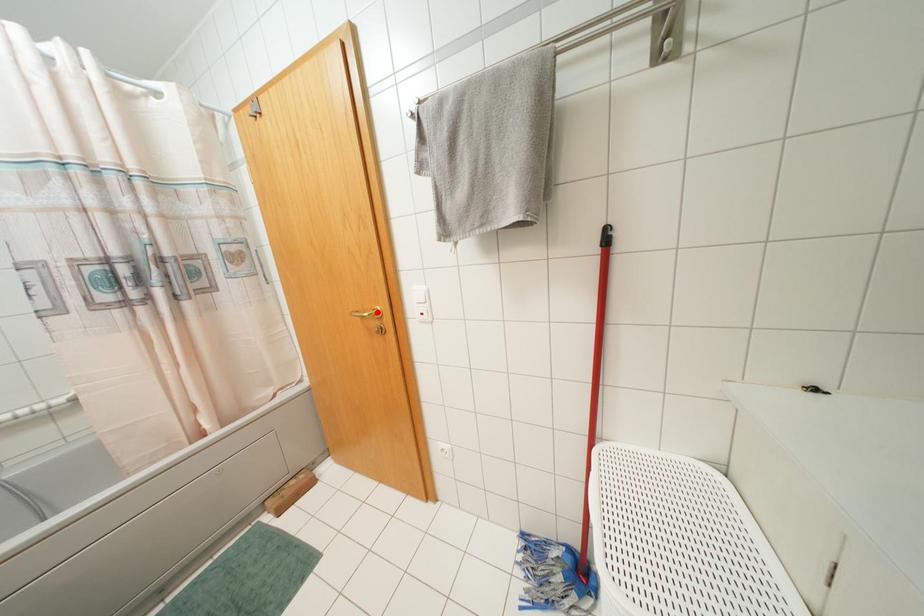
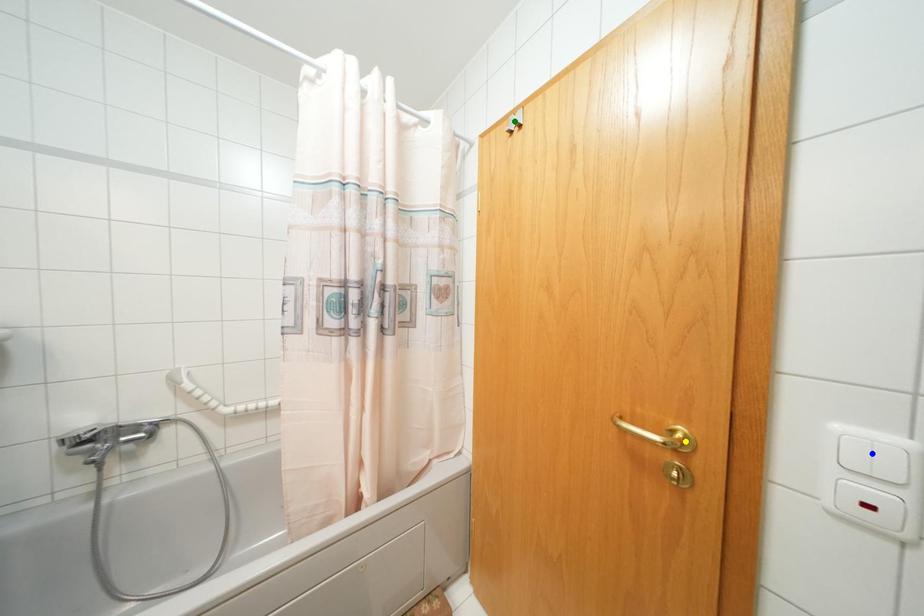
Question: I am providing you with two images of the same scene from different viewpoints. A red point is marked on the first image. You are given multiple points on the second image. Which mark in image 2 goes with the point in image 1?

Choices:
 (A) green point
 (B) yellow point
 (C) blue point

Answer: (B)